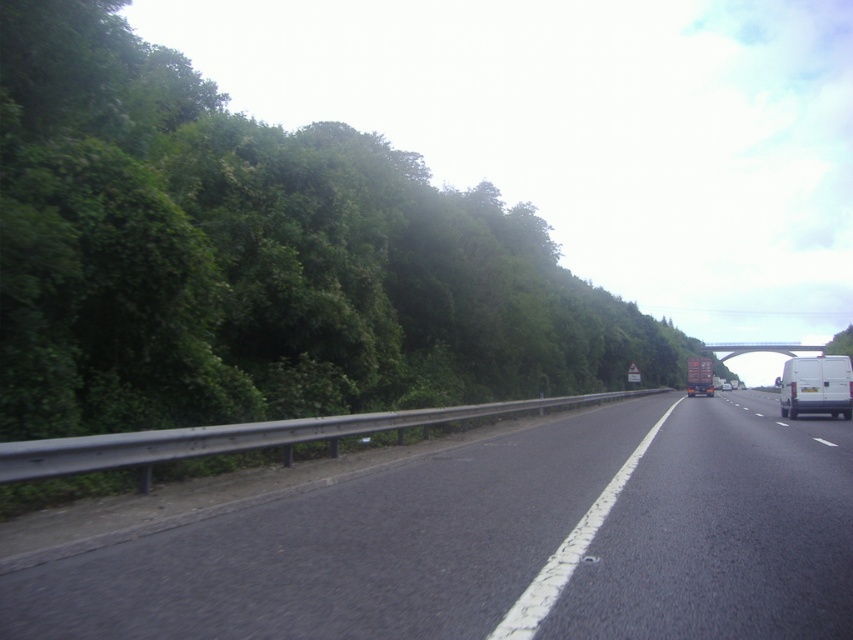
Is green leafy trees at left positioned behind green leafy tree at upper right?

No, green leafy trees at left is closer to the viewer.

Does point (184, 403) lie in front of point (827, 349)?

Yes, point (184, 403) is in front of point (827, 349).

Is point (416, 170) farther from camera compared to point (849, 346)?

No.

You are a GUI agent. You are given a task and a screenshot of the screen. Output one action in this format:
    pyautogui.click(x=<x>, y=<y>)
    Task: Click on the green leafy trees at left
    The width and height of the screenshot is (853, 640).
    Given the screenshot: What is the action you would take?
    pyautogui.click(x=257, y=257)

Does point (242, 403) lie in front of point (709, 385)?

That is True.

In the scene shown: How much distance is there between green leafy trees at left and metallic brown trailer truck at center?

green leafy trees at left and metallic brown trailer truck at center are 27.54 meters apart.

Measure the distance between green leafy trees at left and camera.

green leafy trees at left and camera are 8.18 meters apart.

You are a GUI agent. You are given a task and a screenshot of the screen. Output one action in this format:
    pyautogui.click(x=<x>, y=<y>)
    Task: Click on the green leafy trees at left
    The height and width of the screenshot is (640, 853).
    Given the screenshot: What is the action you would take?
    pyautogui.click(x=257, y=257)

Can you confirm if green leafy trees at left is positioned to the right of white matte van at right?

Incorrect, green leafy trees at left is not on the right side of white matte van at right.

Who is taller, green leafy trees at left or white matte van at right?

green leafy trees at left is taller.

The height and width of the screenshot is (640, 853). Describe the element at coordinates (257, 257) in the screenshot. I see `green leafy trees at left` at that location.

Locate an element on the screen. green leafy trees at left is located at coordinates (257, 257).